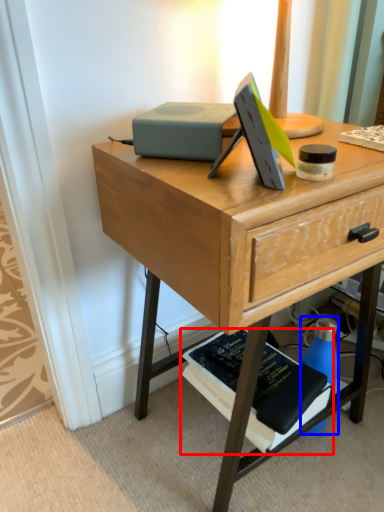
Question: Which point is closer to the camera, paperback book (highlighted by a red box) or bottle (highlighted by a blue box)?

Choices:
 (A) paperback book
 (B) bottle

Answer: (A)